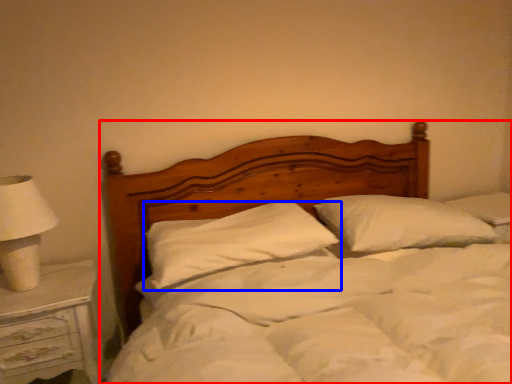
Question: Which object appears closest to the camera in this image, bed (highlighted by a red box) or pillow (highlighted by a blue box)?

Choices:
 (A) bed
 (B) pillow

Answer: (A)